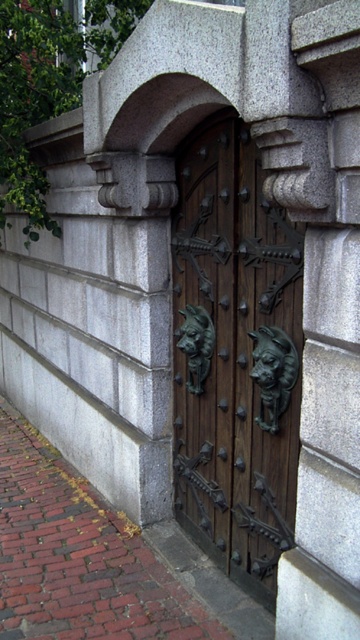
Does wooden door with metal accents at center have a lesser height compared to brick pavement at lower left?

No.

Is point (294, 476) less distant than point (42, 593)?

That is True.

The width and height of the screenshot is (360, 640). I want to click on wooden door with metal accents at center, so click(235, 356).